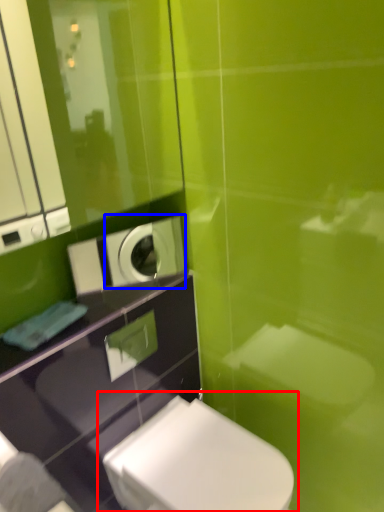
Question: Which point is further to the camera, toilet (highlighted by a red box) or appliance (highlighted by a blue box)?

Choices:
 (A) toilet
 (B) appliance

Answer: (B)